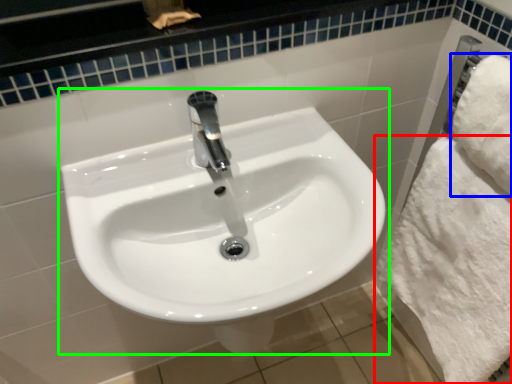
Question: Based on their relative distances, which object is farther from bath towel (highlighted by a red box)? Choose from bath towel (highlighted by a blue box) and sink (highlighted by a green box).

Choices:
 (A) bath towel
 (B) sink

Answer: (B)